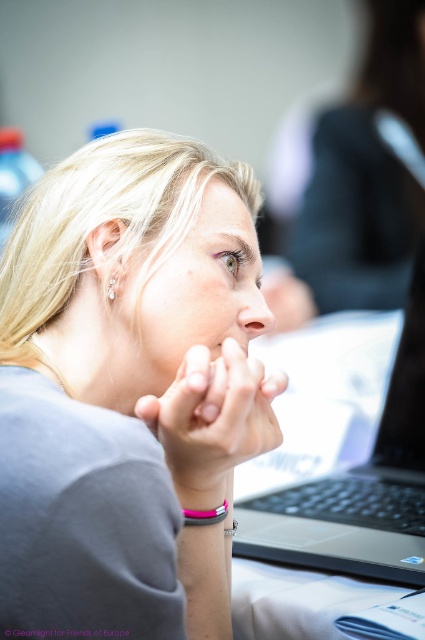
Is sleek black laptop at center wider than silver metallic bracelet at lower center?

Yes.

Image resolution: width=425 pixels, height=640 pixels. What do you see at coordinates (359, 484) in the screenshot? I see `sleek black laptop at center` at bounding box center [359, 484].

Where is `sleek black laptop at center`? sleek black laptop at center is located at coordinates pyautogui.click(x=359, y=484).

Who is positioned more to the left, silver metallic bracelet at lower center or pink rubber bracelet at center?

From the viewer's perspective, silver metallic bracelet at lower center appears more on the left side.

Is silver metallic bracelet at lower center below pink rubber bracelet at center?

Actually, silver metallic bracelet at lower center is above pink rubber bracelet at center.

Find the location of `silver metallic bracelet at lower center`. silver metallic bracelet at lower center is located at coordinates (204, 515).

Does gray matte shirt at center appear under smooth skin hand at center?

No, gray matte shirt at center is not below smooth skin hand at center.

Is gray matte shirt at center to the left of smooth skin hand at center from the viewer's perspective?

Indeed, gray matte shirt at center is positioned on the left side of smooth skin hand at center.

The height and width of the screenshot is (640, 425). Find the location of `gray matte shirt at center`. gray matte shirt at center is located at coordinates (127, 390).